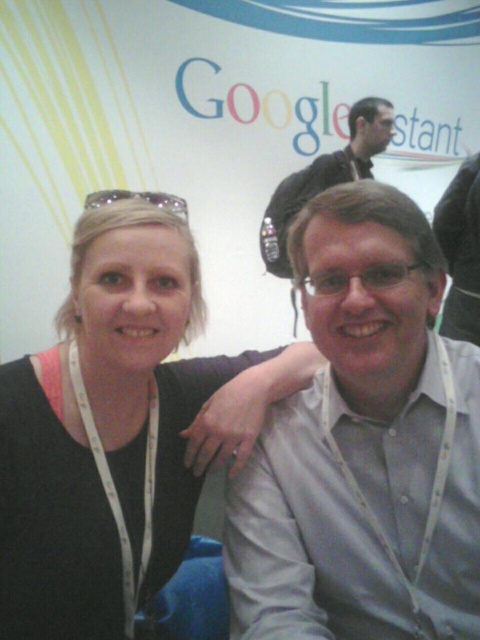
You are at a tech conference and see the image. There is a black fabric at center and a metallic silver goggles at upper left. Which object is positioned to the right of the other?

The black fabric at center is to the right of the metallic silver goggles at upper left.

You are at a conference and need to find the person wearing the gray shirt at center. Which direction should you look relative to the matte black shirt at upper center?

The gray shirt at center is to the left of the matte black shirt at upper center, so you should look to the left of the matte black shirt at upper center to find the person wearing the gray shirt at center.